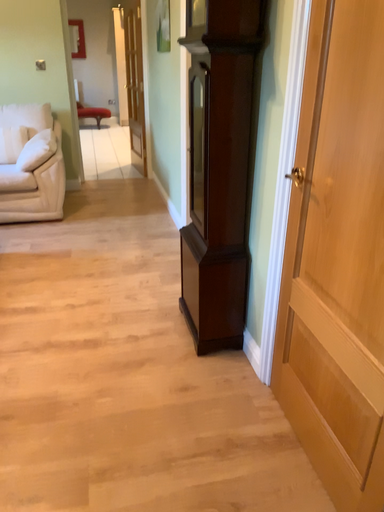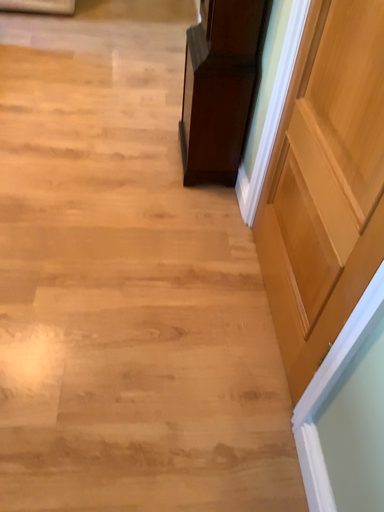
Question: How did the camera likely rotate when shooting the video?

Choices:
 (A) rotated downward
 (B) rotated upward

Answer: (A)